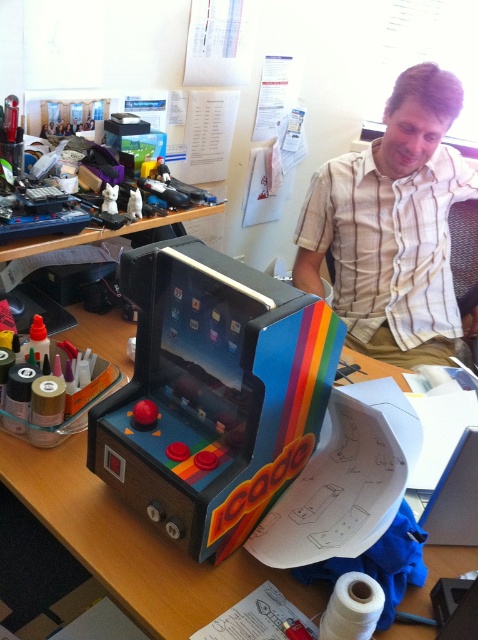
Is rainbow painted arcade cabinet at center behind rubberized plastic toy at center?

No, it is in front of rubberized plastic toy at center.

Find the location of `rainbow painted arcade cabinet at center`. rainbow painted arcade cabinet at center is located at coordinates [214, 394].

Between rubberized plastic toy at center and white plastic toy at center, which one has more height?

white plastic toy at center is taller.

Does rubberized plastic toy at center have a greater height compared to white plastic toy at center?

Incorrect, rubberized plastic toy at center's height is not larger of white plastic toy at center's.

Between point (117, 209) and point (141, 202), which one is positioned behind?

The point (141, 202) is more distant.

Find the location of a particular element. This screenshot has width=478, height=640. rubberized plastic toy at center is located at coordinates (109, 198).

Between rainbow painted arcade cabinet at center and striped cotton shirt at upper right, which one appears on the right side from the viewer's perspective?

Positioned to the right is striped cotton shirt at upper right.

Is rainbow painted arcade cabinet at center thinner than striped cotton shirt at upper right?

Yes.

You are a GUI agent. You are given a task and a screenshot of the screen. Output one action in this format:
    pyautogui.click(x=<x>, y=<y>)
    Task: Click on the rainbow painted arcade cabinet at center
    The image size is (478, 640).
    Given the screenshot: What is the action you would take?
    pyautogui.click(x=214, y=394)